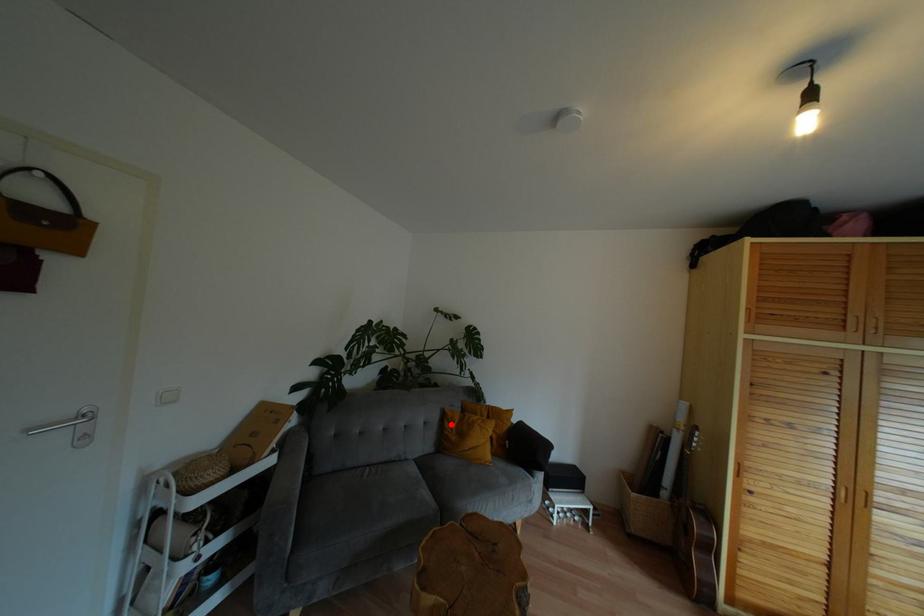
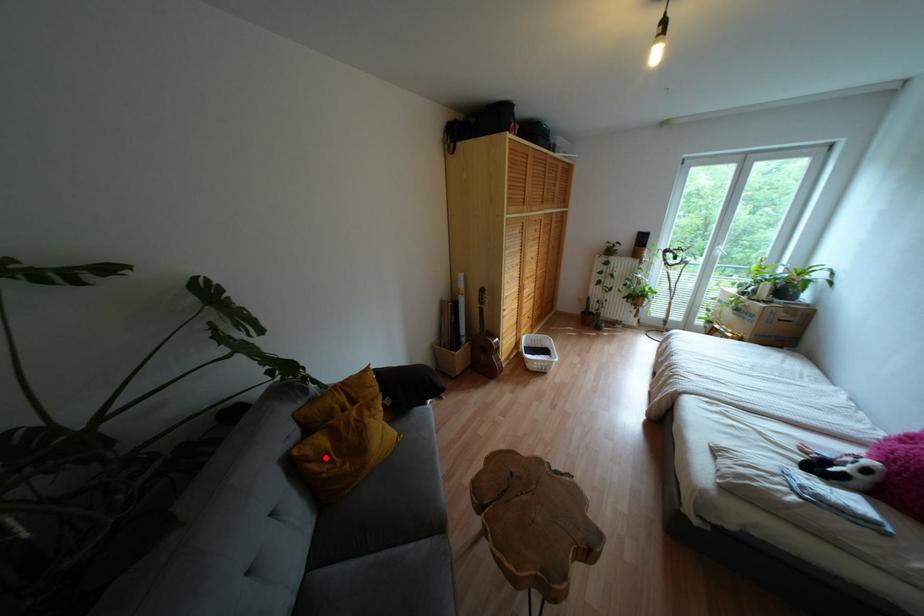
I am providing you with two images of the same scene from different viewpoints. A red point is marked on the first image and another point is marked on the second image. Do the highlighted points in image1 and image2 indicate the same real-world spot?

Yes